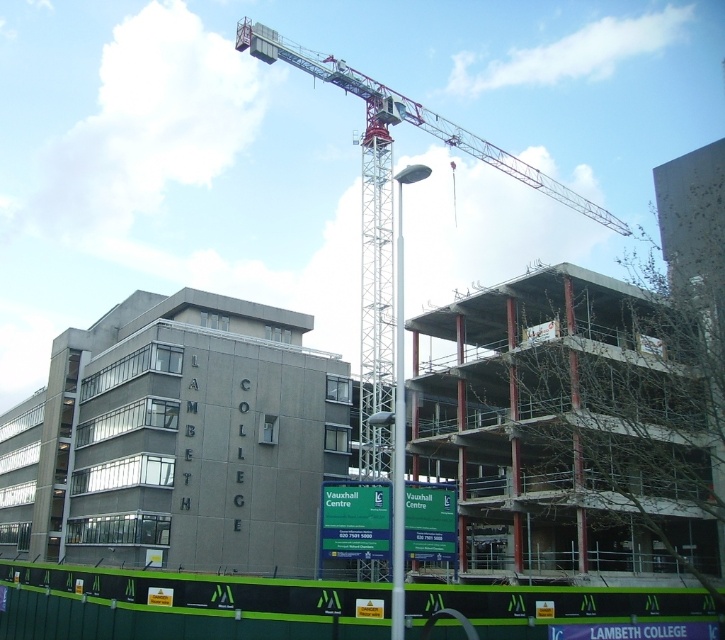
Question: Is metallic gray crane at upper center wider than white metallic pole at center?

Choices:
 (A) yes
 (B) no

Answer: (A)

Question: Considering the real-world distances, which object is farthest from the metallic pole at center?

Choices:
 (A) gray concrete building at left
 (B) white metallic pole at center

Answer: (A)

Question: In this image, where is gray concrete building at left located relative to metallic pole at center?

Choices:
 (A) right
 (B) left

Answer: (B)

Question: Does gray concrete building at left appear on the left side of metallic pole at center?

Choices:
 (A) no
 (B) yes

Answer: (B)

Question: Which of the following is the closest to the observer?

Choices:
 (A) gray concrete building at left
 (B) metallic pole at center
 (C) white metallic pole at center

Answer: (C)

Question: Which point is closer to the camera?

Choices:
 (A) (364, 444)
 (B) (58, 464)
 (C) (401, 292)

Answer: (C)